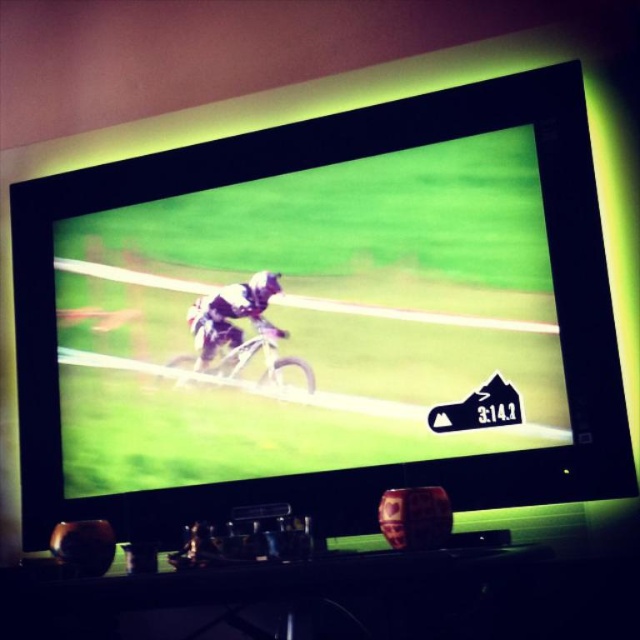
You are playing a video game where your character must navigate a grassy field. Your character is represented by the white matte cyclist at center. The game requires you to move to a specific coordinate point to collect a power up. The coordinate point is at 0.5, 0.36. Is your character already positioned at the correct coordinates?

The white matte cyclist at center is located at point (230, 314), which is very close to the target coordinates of (230, 320). The slight difference in the x and y coordinates means the character is not exactly at the required position.

You are designing a poster for a cycling event and want to highlight both the matte white bicycle at center and the white matte cyclist at center. If you need to ensure that the bicycle appears wider than the cyclist in the design, does the current arrangement on the TV screen already satisfy this requirement?

Yes, the current arrangement on the TV screen already satisfies the requirement because the matte white bicycle at center has a larger width than the white matte cyclist at center according to the description.

You are playing a video game where you control a character that needs to jump over an obstacle. The game screen shows a white matte cyclist at center and a metallic silver dirt bike at center. Which object is positioned higher on the screen?

The white matte cyclist at center is located above the metallic silver dirt bike at center, so it is positioned higher on the screen.